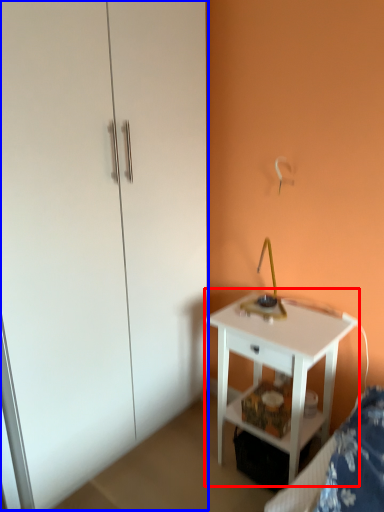
Question: Which object appears closest to the camera in this image, nightstand (highlighted by a red box) or dresser (highlighted by a blue box)?

Choices:
 (A) nightstand
 (B) dresser

Answer: (B)